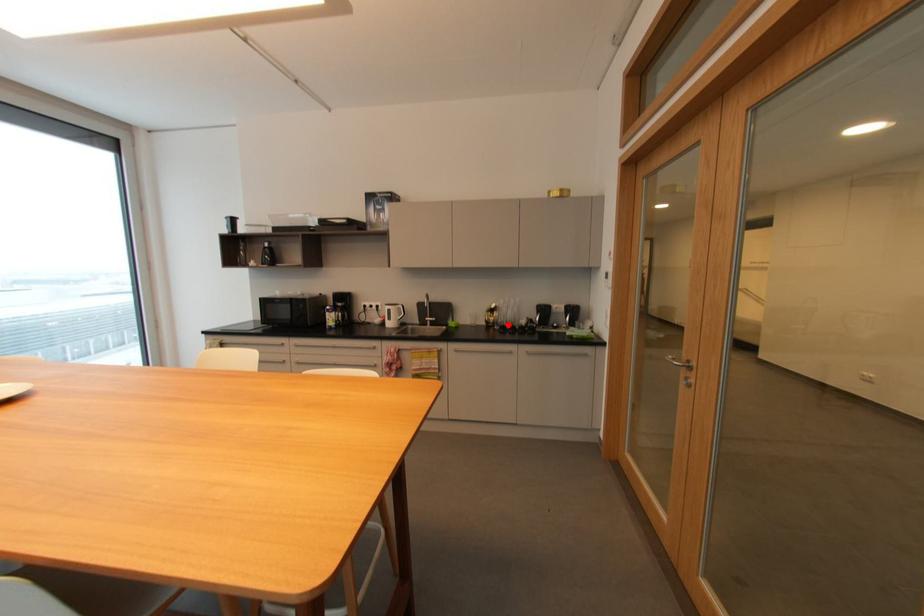
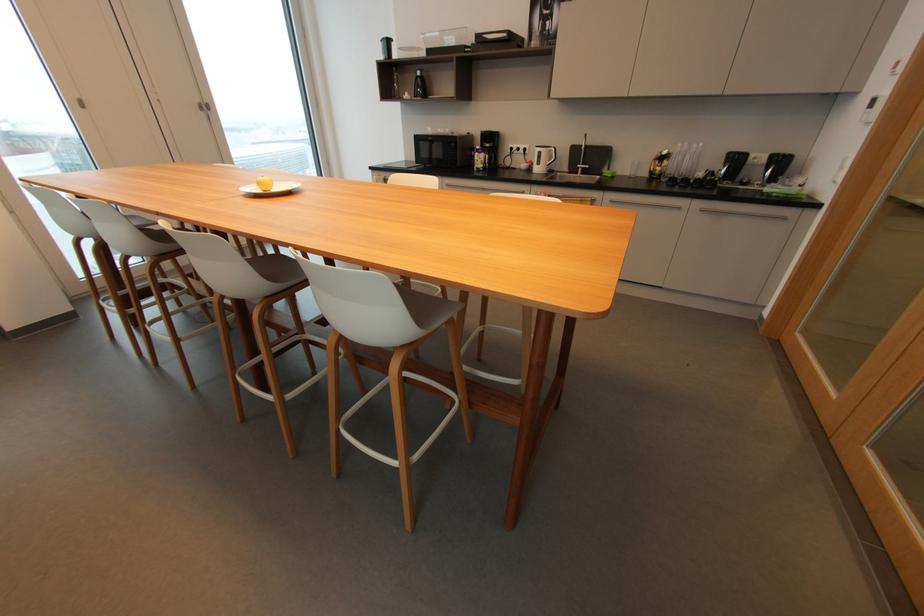
Where in the second image is the point corresponding to the highlighted location from the first image?

(678, 177)